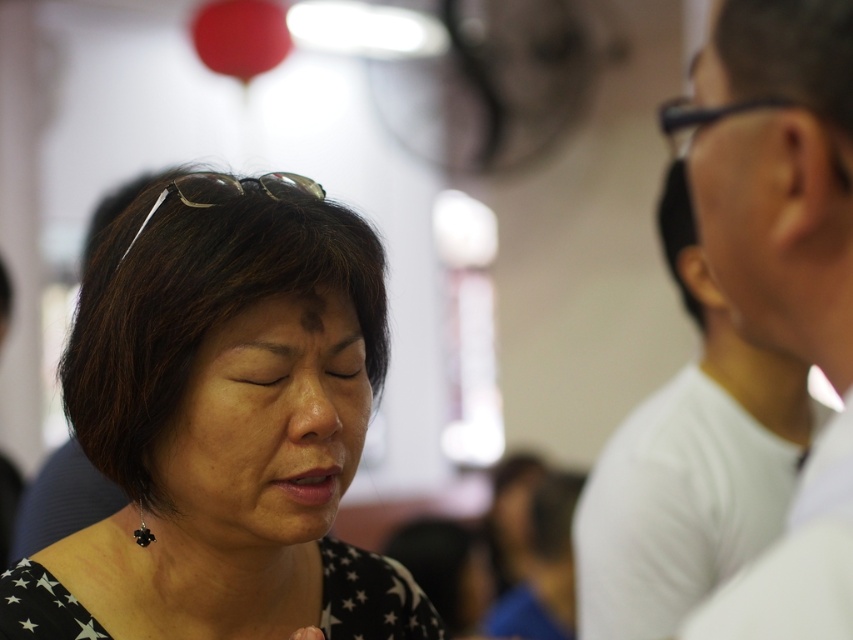
Question: Estimate the real-world distances between objects in this image. Which object is farther from the matte white face at right?

Choices:
 (A) black matte/soft fabric at center
 (B) smooth skin face at center

Answer: (A)

Question: Can you confirm if black matte/soft fabric at center is positioned to the left of matte white face at right?

Choices:
 (A) yes
 (B) no

Answer: (A)

Question: Does black matte/soft fabric at center appear on the right side of matte white face at right?

Choices:
 (A) no
 (B) yes

Answer: (A)

Question: Which point is farther to the camera?

Choices:
 (A) (751, 310)
 (B) (250, 240)
 (C) (209, 474)

Answer: (C)

Question: Does smooth skin face at center have a lesser width compared to matte white face at right?

Choices:
 (A) yes
 (B) no

Answer: (A)

Question: Which object is the closest to the smooth skin face at center?

Choices:
 (A) matte white face at right
 (B) black matte/soft fabric at center

Answer: (B)